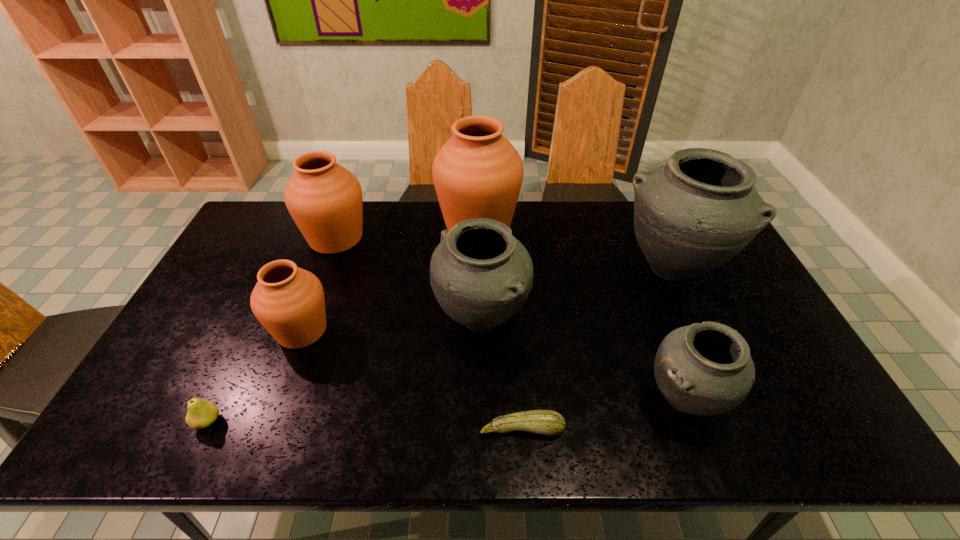
I want to click on blank space located 0.320m on the right of the biggest brown urn, so tap(610, 226).

The height and width of the screenshot is (540, 960). Identify the location of vacant region located 0.150m on the left of the biggest black urn. (572, 268).

The image size is (960, 540). I want to click on vacant region located 0.340m on the front of the second biggest brown urn, so click(x=297, y=346).

You are a GUI agent. You are given a task and a screenshot of the screen. Output one action in this format:
    pyautogui.click(x=<x>, y=<y>)
    Task: Click on the free space located on the left of the leftmost black urn
    
    Given the screenshot: What is the action you would take?
    pyautogui.click(x=368, y=319)

The height and width of the screenshot is (540, 960). Identify the location of free space located on the right of the smallest brown urn. (395, 330).

Image resolution: width=960 pixels, height=540 pixels. I want to click on vacant area located on the right of the nearest black urn, so click(791, 399).

Where is `free space located 0.360m on the right of the second shortest object`? This screenshot has width=960, height=540. free space located 0.360m on the right of the second shortest object is located at coordinates coord(376,422).

Identify the location of urn located at the near edge. The image size is (960, 540). (705, 369).

Find the location of a particular element. pear positioned at the near edge is located at coordinates (201, 413).

Locate an element on the screen. The height and width of the screenshot is (540, 960). zucchini present at the near edge is located at coordinates (547, 422).